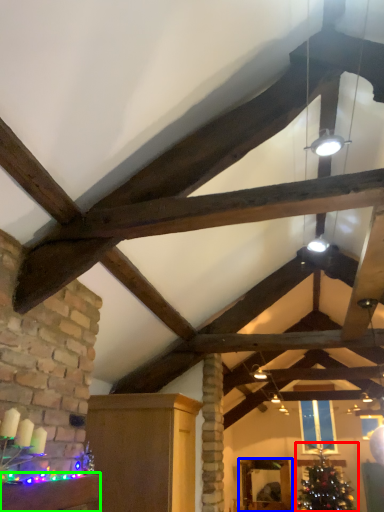
Question: Considering the real-world distances, which object is farthest from christmas tree (highlighted by a red box)? furniture (highlighted by a blue box) or furniture (highlighted by a green box)?

Choices:
 (A) furniture
 (B) furniture

Answer: (B)